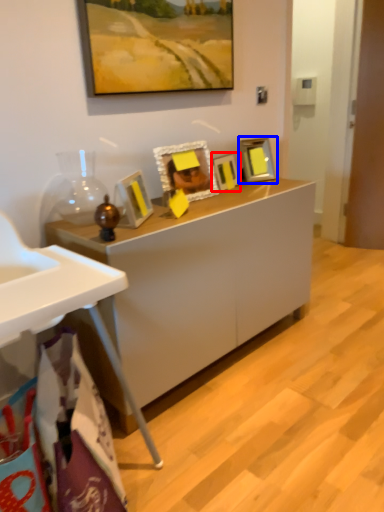
Question: Which point is closer to the camera, picture frame (highlighted by a red box) or picture frame (highlighted by a blue box)?

Choices:
 (A) picture frame
 (B) picture frame

Answer: (A)